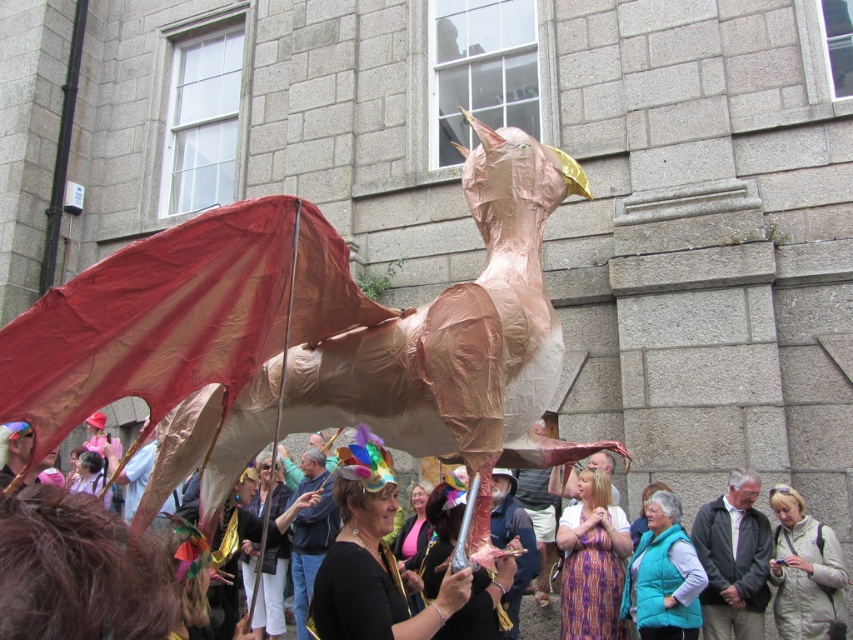
Question: Which object is farther from the camera taking this photo?

Choices:
 (A) light beige jacket at center
 (B) matte gold dragon at center
 (C) printed fabric dress at center
 (D) gray fabric jacket at center

Answer: (C)

Question: Among these objects, which one is farthest from the camera?

Choices:
 (A) gold papier-mâché dragon at center
 (B) gray fabric jacket at center

Answer: (B)

Question: Is light beige jacket at center to the left of teal puffer vest at center from the viewer's perspective?

Choices:
 (A) yes
 (B) no

Answer: (B)

Question: From the image, what is the correct spatial relationship of matte gold dragon at center in relation to light beige jacket at center?

Choices:
 (A) left
 (B) right

Answer: (A)

Question: Which point is farther to the camera?

Choices:
 (A) teal puffer vest at center
 (B) light beige jacket at center

Answer: (A)

Question: Where is matte gold dragon at center located in relation to light beige jacket at center in the image?

Choices:
 (A) above
 (B) below

Answer: (A)